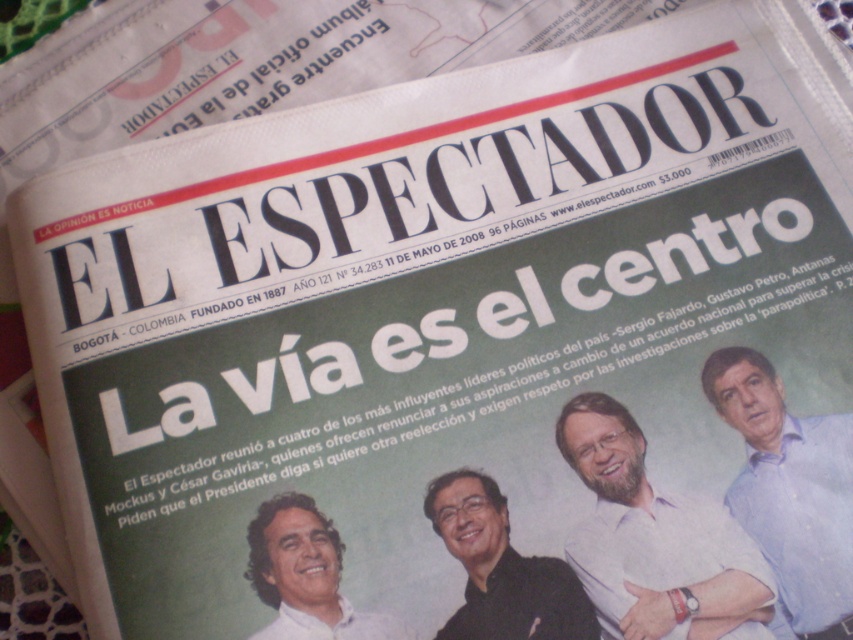
Can you confirm if light purple shirt at center is bigger than smooth white face at center?

Indeed, light purple shirt at center has a larger size compared to smooth white face at center.

Is point (683, 621) positioned before point (297, 499)?

Yes, it is.

At what (x,y) coordinates should I click in order to perform the action: click on light purple shirt at center. Please return your answer as a coordinate pair (x, y). Image resolution: width=853 pixels, height=640 pixels. Looking at the image, I should click on (654, 540).

Describe the element at coordinates (654, 540) in the screenshot. The height and width of the screenshot is (640, 853). I see `light purple shirt at center` at that location.

Does point (675, 528) lie behind point (532, 611)?

Yes, point (675, 528) is behind point (532, 611).

Image resolution: width=853 pixels, height=640 pixels. What do you see at coordinates (654, 540) in the screenshot?
I see `light purple shirt at center` at bounding box center [654, 540].

Find the location of a particular element. light purple shirt at center is located at coordinates (654, 540).

Between light blue shirt at right and black matte shirt at center, which one is positioned higher?

light blue shirt at right is above.

Which is behind, point (735, 497) or point (515, 554)?

The point (735, 497) is more distant.

Where is `light blue shirt at right`? light blue shirt at right is located at coordinates (790, 492).